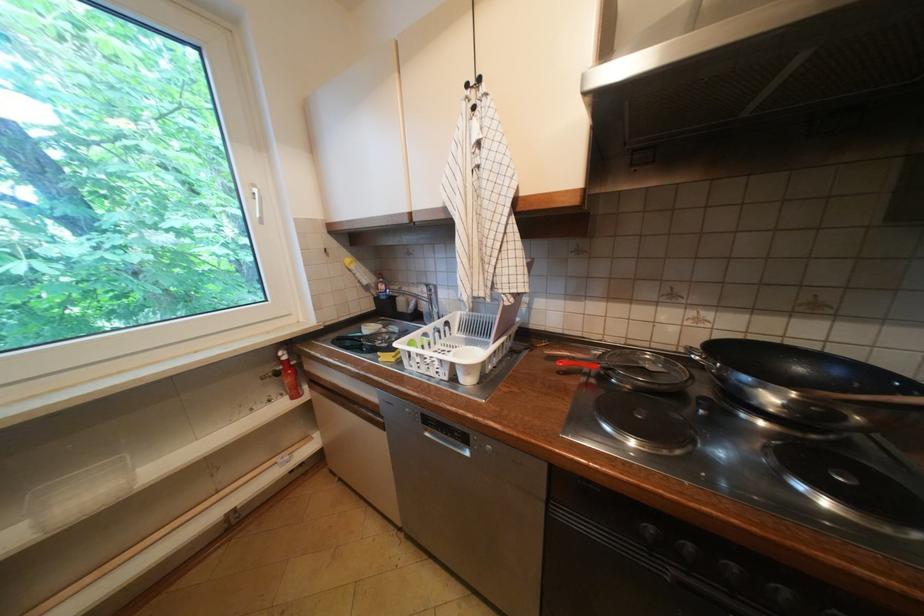
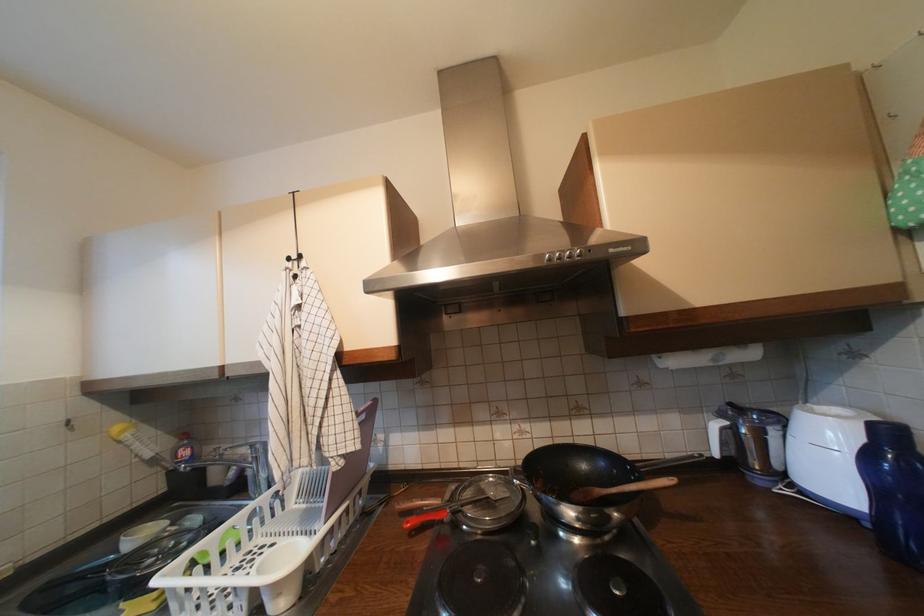
In the second image, find the point that corresponds to (x=554, y=352) in the first image.

(407, 506)